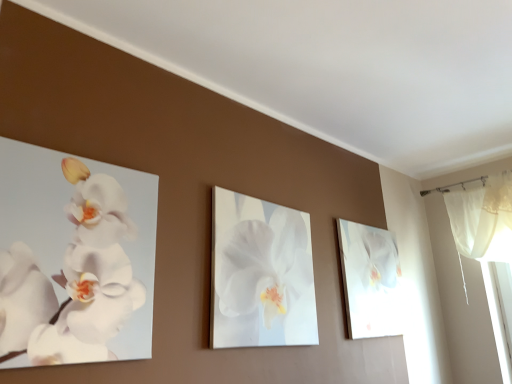
Question: Is white matte orchid at left, which appears as the first flower when viewed from the left, wider than white glossy orchid painting at right?

Choices:
 (A) no
 (B) yes

Answer: (A)

Question: Is white matte orchid at left, which appears as the first flower when viewed from the left, facing away from white glossy orchid painting at right?

Choices:
 (A) yes
 (B) no

Answer: (B)

Question: Is white matte orchid at left, which is the 1th flower from front to back, shorter than white glossy orchid painting at right?

Choices:
 (A) no
 (B) yes

Answer: (B)

Question: Is white glossy orchid painting at right surrounded by white matte orchid at left, which appears as the first flower when viewed from the left?

Choices:
 (A) yes
 (B) no

Answer: (B)

Question: Does white matte orchid at left, which is the 1th flower from front to back, appear on the left side of white glossy orchid painting at right?

Choices:
 (A) yes
 (B) no

Answer: (A)

Question: Is point pyautogui.click(x=263, y=299) closer or farther from the camera than point pyautogui.click(x=360, y=236)?

Choices:
 (A) farther
 (B) closer

Answer: (B)

Question: From the image's perspective, is white glossy orchid at center, which is the first flower from right to left, positioned above or below white glossy orchid painting at right?

Choices:
 (A) below
 (B) above

Answer: (B)

Question: Is white glossy orchid at center, which is the first flower from right to left, bigger or smaller than white glossy orchid painting at right?

Choices:
 (A) big
 (B) small

Answer: (B)

Question: Is white glossy orchid at center, which is the first flower from right to left, wider or thinner than white glossy orchid painting at right?

Choices:
 (A) wide
 (B) thin

Answer: (B)

Question: Is white matte orchid at left, marked as the 2th flower in a right-to-left arrangement, situated inside white glossy orchid at center, the first flower when ordered from back to front, or outside?

Choices:
 (A) outside
 (B) inside

Answer: (A)

Question: Based on their sizes in the image, would you say white matte orchid at left, marked as the 2th flower in a right-to-left arrangement, is bigger or smaller than white glossy orchid at center, the 2th flower positioned from the left?

Choices:
 (A) small
 (B) big

Answer: (A)

Question: From a real-world perspective, is white matte orchid at left, which is the 1th flower from front to back, physically located above or below white glossy orchid at center, which is the first flower from right to left?

Choices:
 (A) above
 (B) below

Answer: (B)

Question: Is white matte orchid at left, which is the 1th flower from front to back, to the left or to the right of white glossy orchid at center, the 2th flower positioned from the front, in the image?

Choices:
 (A) right
 (B) left

Answer: (B)

Question: From the image's perspective, is white matte orchid at left, arranged as the second flower when viewed from the back, positioned above or below white glossy orchid painting at right?

Choices:
 (A) below
 (B) above

Answer: (B)

Question: In the image, is white matte orchid at left, which appears as the first flower when viewed from the left, positioned in front of or behind white glossy orchid painting at right?

Choices:
 (A) front
 (B) behind

Answer: (A)